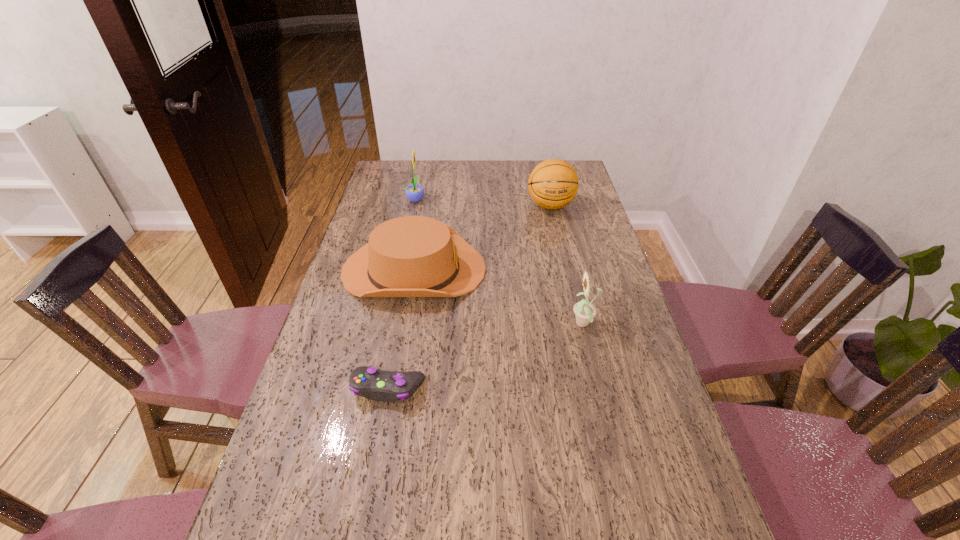
Identify the location of the farther sunflower. (414, 192).

Locate an element on the screen. The image size is (960, 540). basketball is located at coordinates (553, 184).

Find the location of a particular element. the nearer sunflower is located at coordinates (584, 311).

At what (x,y) coordinates should I click in order to perform the action: click on the right sunflower. Please return your answer as a coordinate pair (x, y). This screenshot has height=540, width=960. Looking at the image, I should click on (584, 311).

Locate an element on the screen. The width and height of the screenshot is (960, 540). the third farthest object is located at coordinates (412, 256).

Identify the location of cowboy hat. (412, 256).

You are a GUI agent. You are given a task and a screenshot of the screen. Output one action in this format:
    pyautogui.click(x=<x>, y=<y>)
    Task: Click on the shortest object
    This screenshot has width=960, height=540.
    Given the screenshot: What is the action you would take?
    pyautogui.click(x=387, y=386)

Image resolution: width=960 pixels, height=540 pixels. Find the location of `control`. control is located at coordinates (387, 386).

Image resolution: width=960 pixels, height=540 pixels. Identify the location of free spot located 0.340m on the front-facing side of the farther sunflower. (509, 199).

Where is `vacant space located 0.150m on the surface of the basketball near the brand logo`? This screenshot has width=960, height=540. vacant space located 0.150m on the surface of the basketball near the brand logo is located at coordinates (559, 242).